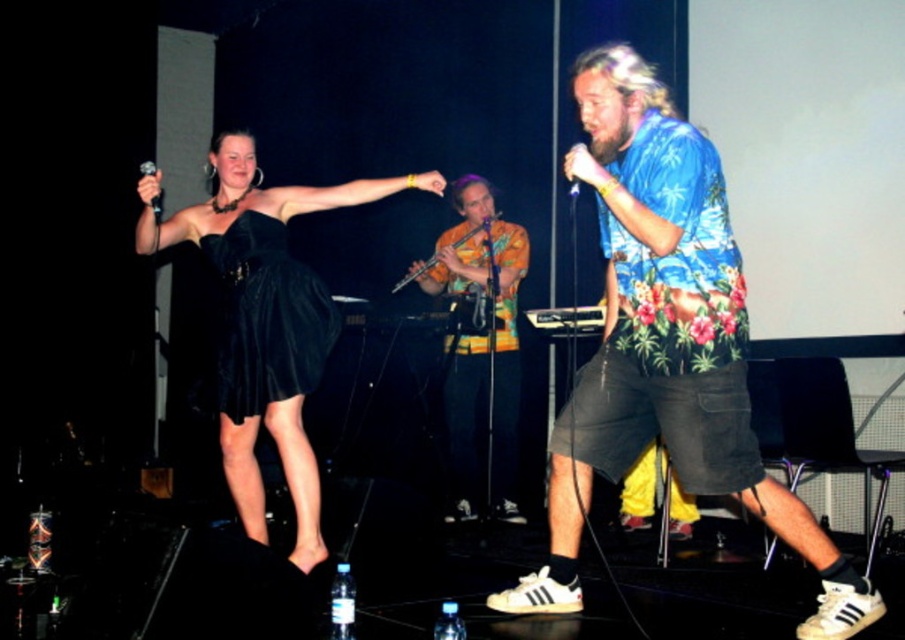
Question: Which object is the closest to the black satin dress at upper left?

Choices:
 (A) black velvet dress at center
 (B) floral print shirt at center
 (C) wooden flute at center
 (D) metallic silver microphone at upper left

Answer: (A)

Question: Based on their relative distances, which object is farther from the matte black microphone at center?

Choices:
 (A) metallic silver microphone at upper left
 (B) wooden flute at center
 (C) floral print shirt at center

Answer: (B)

Question: Can you confirm if black velvet dress at center is positioned below metallic silver microphone at upper left?

Choices:
 (A) no
 (B) yes

Answer: (B)

Question: Is black satin dress at upper left positioned at the back of black velvet dress at center?

Choices:
 (A) yes
 (B) no

Answer: (B)

Question: Can you confirm if wooden flute at center is wider than metallic silver microphone at upper left?

Choices:
 (A) yes
 (B) no

Answer: (A)

Question: Which object is closer to the camera taking this photo?

Choices:
 (A) black satin dress at upper left
 (B) black velvet dress at center
 (C) wooden flute at center
 (D) matte black microphone at center

Answer: (D)